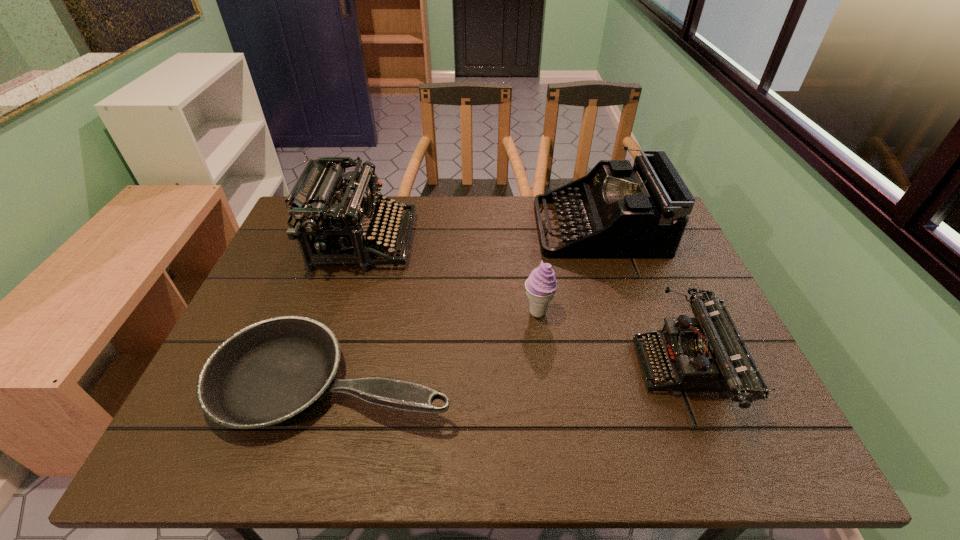
Where is `vacant point located 0.310m on the back of the frying pan`? This screenshot has height=540, width=960. vacant point located 0.310m on the back of the frying pan is located at coordinates (371, 249).

This screenshot has width=960, height=540. I want to click on typewriter that is at the near edge, so click(707, 353).

Identify the location of frying pan present at the near edge. (271, 371).

Identify the location of typewriter at the left edge. (336, 223).

Where is `frying pan that is at the left edge`? This screenshot has width=960, height=540. frying pan that is at the left edge is located at coordinates (271, 371).

You are a GUI agent. You are given a task and a screenshot of the screen. Output one action in this format:
    pyautogui.click(x=<x>, y=<y>)
    Task: Click on the object that is positioned at the far left corner
    The width and height of the screenshot is (960, 540).
    Given the screenshot: What is the action you would take?
    pyautogui.click(x=336, y=223)

Identify the location of object that is at the near left corner. This screenshot has height=540, width=960. (271, 371).

Locate an element on the screen. The image size is (960, 540). object that is at the far right corner is located at coordinates (641, 212).

Locate an element on the screen. object at the near right corner is located at coordinates [707, 353].

Where is `vacant space at the far edge of the desktop`? The width and height of the screenshot is (960, 540). vacant space at the far edge of the desktop is located at coordinates (445, 224).